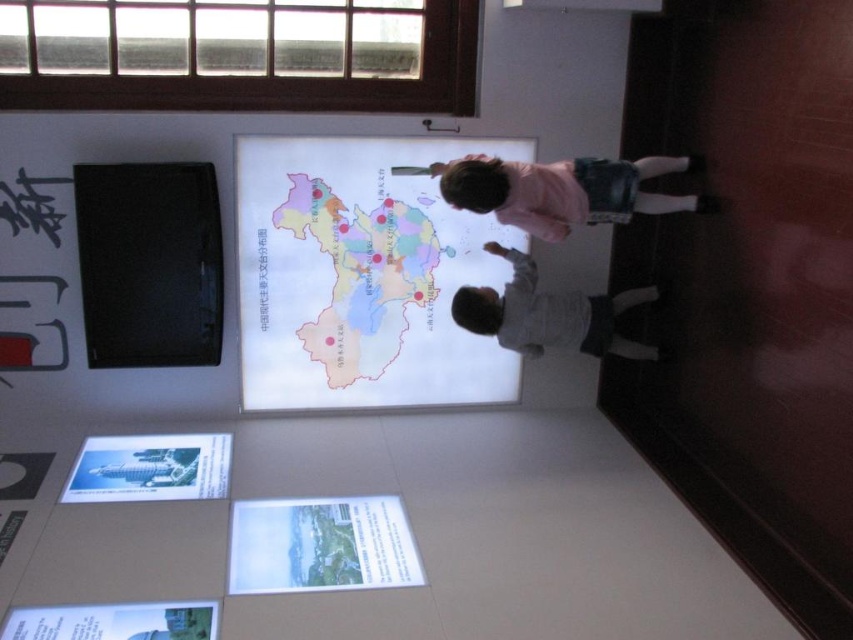
Is white matte map at center positioned before pink fabric at upper right?

No.

This screenshot has width=853, height=640. What are the coordinates of `white matte map at center` in the screenshot? It's located at (363, 275).

What are the coordinates of `white matte map at center` in the screenshot? It's located at (363, 275).

Is point (361, 317) positioned before point (465, 330)?

No, (361, 317) is behind (465, 330).

Between point (340, 269) and point (641, 353), which one is positioned behind?

The point (641, 353) is behind.

Which is in front, point (363, 301) or point (482, 300)?

Point (482, 300) is more forward.

Locate an element on the screen. map at center is located at coordinates (361, 275).

Between point (437, 256) and point (546, 176), which one is positioned behind?

The point (437, 256) is behind.

Locate an element on the screen. This screenshot has width=853, height=640. map at center is located at coordinates (361, 275).

Locate an element on the screen. This screenshot has height=640, width=853. map at center is located at coordinates point(361,275).